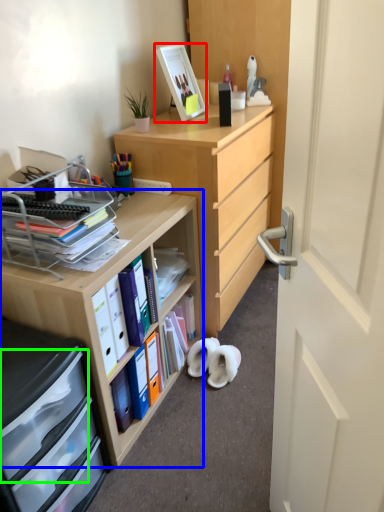
Question: Which is farther away from picture frame (highlighted by a red box)? desk (highlighted by a blue box) or drawer (highlighted by a green box)?

Choices:
 (A) desk
 (B) drawer

Answer: (B)